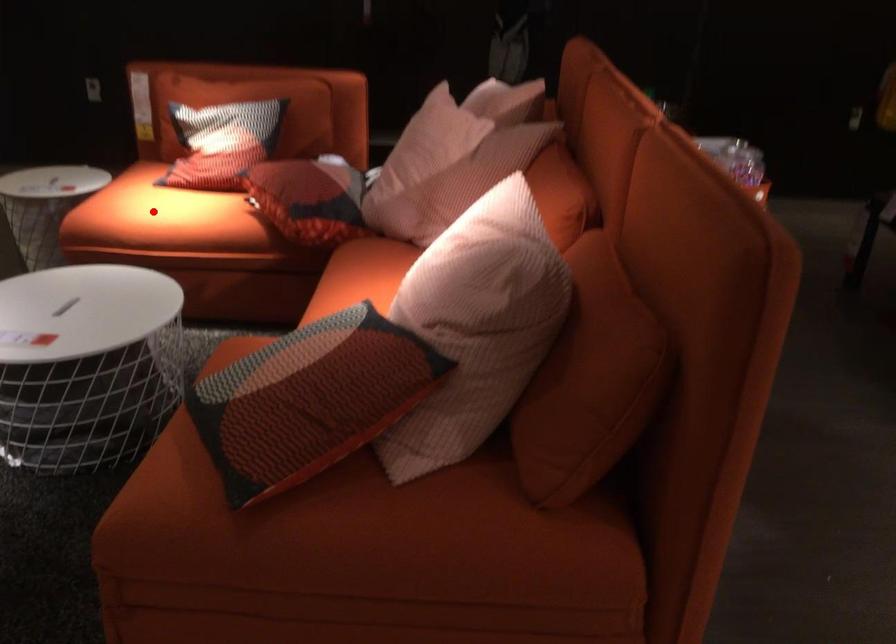
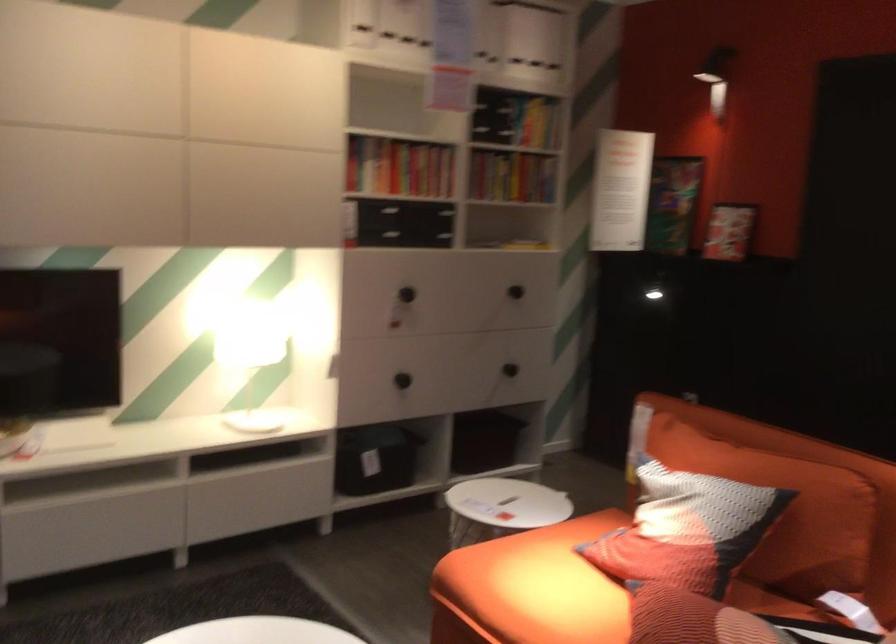
Question: I am providing you with two images of the same scene from different viewpoints. A red point is shown in image1. For the corresponding object point in image2, is it positioned nearer or farther from the camera?

Choices:
 (A) Nearer
 (B) Farther

Answer: (A)